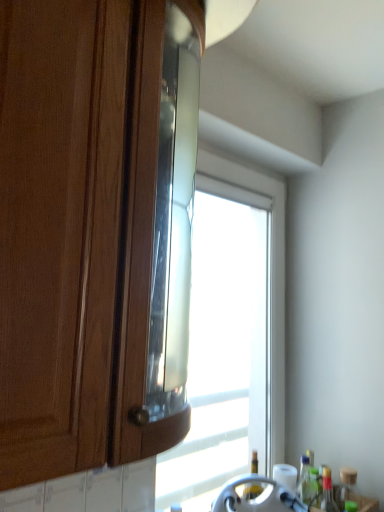
Question: From the image's perspective, does transparent glass window at center appear higher than transparent glass bottle at lower right, placed as the third bottle when sorted from right to left?

Choices:
 (A) no
 (B) yes

Answer: (B)

Question: Is transparent glass window at center outside of transparent glass bottle at lower right, placed as the third bottle when sorted from right to left?

Choices:
 (A) no
 (B) yes

Answer: (B)

Question: From a real-world perspective, is transparent glass window at center under transparent glass bottle at lower right, placed as the third bottle when sorted from right to left?

Choices:
 (A) no
 (B) yes

Answer: (A)

Question: Does transparent glass window at center have a greater width compared to transparent glass bottle at lower right, placed as the third bottle when sorted from right to left?

Choices:
 (A) yes
 (B) no

Answer: (A)

Question: Could you tell me if transparent glass window at center is facing transparent glass bottle at lower right, placed as the third bottle when sorted from right to left?

Choices:
 (A) yes
 (B) no

Answer: (A)

Question: Considering the relative sizes of transparent glass window at center and transparent glass bottle at lower right, placed as the third bottle when sorted from right to left, in the image provided, is transparent glass window at center bigger than transparent glass bottle at lower right, placed as the third bottle when sorted from right to left,?

Choices:
 (A) no
 (B) yes

Answer: (B)

Question: Is matte wood cabinet at left not within transparent glass window at center?

Choices:
 (A) no
 (B) yes

Answer: (B)

Question: Could you tell me if matte wood cabinet at left is facing transparent glass window at center?

Choices:
 (A) yes
 (B) no

Answer: (B)

Question: Would you consider matte wood cabinet at left to be distant from transparent glass window at center?

Choices:
 (A) yes
 (B) no

Answer: (B)

Question: From the image's perspective, is matte wood cabinet at left above transparent glass window at center?

Choices:
 (A) no
 (B) yes

Answer: (B)

Question: From a real-world perspective, is matte wood cabinet at left on top of transparent glass window at center?

Choices:
 (A) no
 (B) yes

Answer: (B)

Question: Is matte wood cabinet at left further to the viewer compared to transparent glass window at center?

Choices:
 (A) no
 (B) yes

Answer: (A)

Question: Is transparent glass bottle at lower right, placed as the third bottle when sorted from right to left, completely or partially inside matte wood cabinet at left?

Choices:
 (A) no
 (B) yes

Answer: (A)